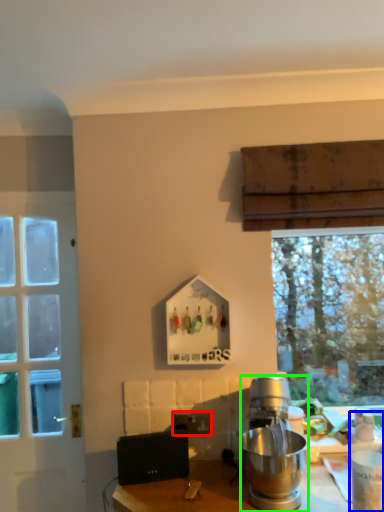
Question: Estimate the real-world distances between objects in this image. Which object is closer to power outlet (highlighted by a red box), bottle (highlighted by a blue box) or kitchen appliance (highlighted by a green box)?

Choices:
 (A) bottle
 (B) kitchen appliance

Answer: (B)